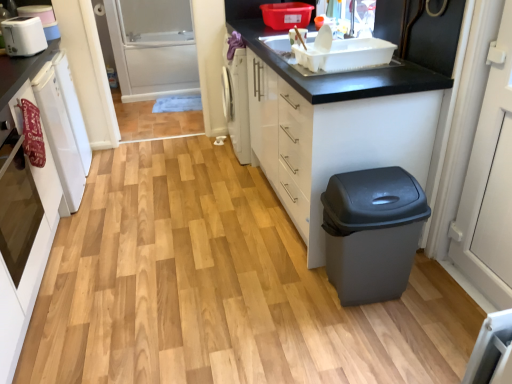
Question: Can you confirm if white glossy cabinet at lower right, the 2th cabinetry when ordered from left to right, is taller than matte gray plastic trash can at lower right?

Choices:
 (A) yes
 (B) no

Answer: (A)

Question: Can you see white glossy cabinet at lower right, the 2th cabinetry when ordered from left to right, touching matte gray plastic trash can at lower right?

Choices:
 (A) no
 (B) yes

Answer: (A)

Question: Is white glossy cabinet at lower right, the first cabinetry when ordered from right to left, aimed at matte gray plastic trash can at lower right?

Choices:
 (A) no
 (B) yes

Answer: (A)

Question: From a real-world perspective, is white glossy cabinet at lower right, the first cabinetry when ordered from right to left, physically above matte gray plastic trash can at lower right?

Choices:
 (A) yes
 (B) no

Answer: (A)

Question: Does white glossy cabinet at lower right, the 2th cabinetry when ordered from left to right, have a smaller size compared to matte gray plastic trash can at lower right?

Choices:
 (A) no
 (B) yes

Answer: (A)

Question: From the image's perspective, is white glossy cabinet at lower right, the 2th cabinetry when ordered from left to right, positioned above or below white plastic sink at upper center?

Choices:
 (A) above
 (B) below

Answer: (B)

Question: Relative to white plastic sink at upper center, is white glossy cabinet at lower right, the 2th cabinetry when ordered from left to right, in front or behind?

Choices:
 (A) behind
 (B) front

Answer: (B)

Question: From a real-world perspective, is white glossy cabinet at lower right, the first cabinetry when ordered from right to left, physically located above or below white plastic sink at upper center?

Choices:
 (A) below
 (B) above

Answer: (A)

Question: Visually, is white glossy cabinet at lower right, the 2th cabinetry when ordered from left to right, positioned to the left or to the right of white plastic sink at upper center?

Choices:
 (A) right
 (B) left

Answer: (B)

Question: In terms of width, does white glossy oven at left, acting as the first cabinetry starting from the left, look wider or thinner when compared to white glossy cabinet at lower right, the 2th cabinetry when ordered from left to right?

Choices:
 (A) wide
 (B) thin

Answer: (B)

Question: Is point (29, 279) closer or farther from the camera than point (300, 158)?

Choices:
 (A) closer
 (B) farther

Answer: (A)

Question: In the image, is white glossy oven at left, which is counted as the 2th cabinetry, starting from the right, on the left side or the right side of white glossy cabinet at lower right, the first cabinetry when ordered from right to left?

Choices:
 (A) right
 (B) left

Answer: (B)

Question: From the image's perspective, is white glossy oven at left, acting as the first cabinetry starting from the left, above or below white glossy cabinet at lower right, the 2th cabinetry when ordered from left to right?

Choices:
 (A) above
 (B) below

Answer: (B)

Question: Considering the positions of white glossy cabinet at lower right, the first cabinetry when ordered from right to left, and matte gray plastic trash can at lower right in the image, is white glossy cabinet at lower right, the first cabinetry when ordered from right to left, taller or shorter than matte gray plastic trash can at lower right?

Choices:
 (A) short
 (B) tall

Answer: (B)

Question: Is white glossy cabinet at lower right, the 2th cabinetry when ordered from left to right, inside or outside of matte gray plastic trash can at lower right?

Choices:
 (A) outside
 (B) inside

Answer: (A)